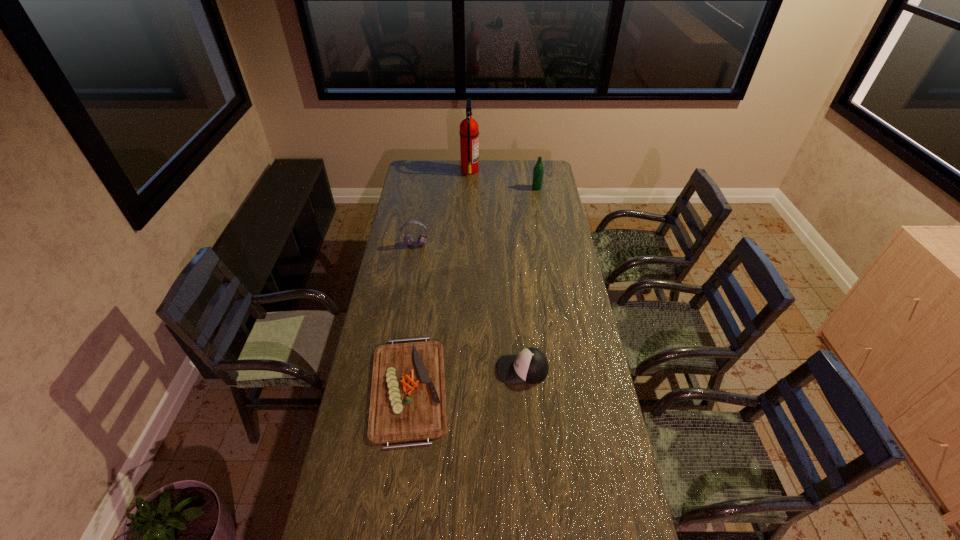
In order to click on blank space located on the left of the bottle in this screenshot , I will do `click(515, 188)`.

This screenshot has width=960, height=540. Identify the location of vacant space located 0.390m on the headband and ear cups of the third nearest object. (406, 307).

Locate an element on the screen. The image size is (960, 540). blank space located 0.070m on the front panel of the second shortest object is located at coordinates (479, 369).

Locate an element on the screen. Image resolution: width=960 pixels, height=540 pixels. blank space located 0.270m on the front panel of the second shortest object is located at coordinates (425, 369).

Where is `vacant area situated on the front panel of the second shortest object`? vacant area situated on the front panel of the second shortest object is located at coordinates coord(431,369).

This screenshot has height=540, width=960. Find the location of `vacant space situated 0.190m on the front of the chopping board`. vacant space situated 0.190m on the front of the chopping board is located at coordinates (392, 512).

Locate an element on the screen. object present at the far edge is located at coordinates (469, 148).

Image resolution: width=960 pixels, height=540 pixels. In order to click on headset that is positioned at the left edge in this screenshot , I will do `click(408, 239)`.

This screenshot has width=960, height=540. What are the coordinates of `chopping board that is at the left edge` in the screenshot? It's located at (408, 402).

In order to click on object located in the right edge section of the desktop in this screenshot , I will do `click(538, 171)`.